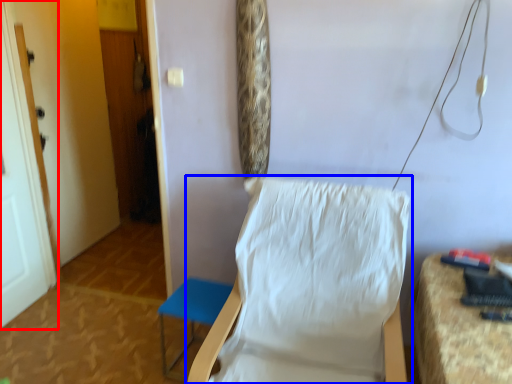
Question: Which point is further to the camera, door (highlighted by a red box) or chair (highlighted by a blue box)?

Choices:
 (A) door
 (B) chair

Answer: (A)